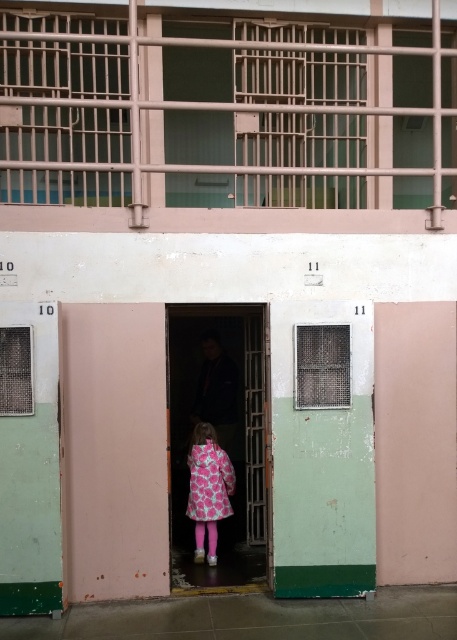
Between pink fabric coat at center and pink floral fabric dress at center, which one appears on the left side from the viewer's perspective?

Positioned to the left is pink floral fabric dress at center.

Between pink fabric coat at center and pink floral fabric dress at center, which one is positioned lower?

pink floral fabric dress at center is below.

Describe the element at coordinates (219, 436) in the screenshot. I see `pink fabric coat at center` at that location.

This screenshot has width=457, height=640. I want to click on pink fabric coat at center, so click(x=219, y=436).